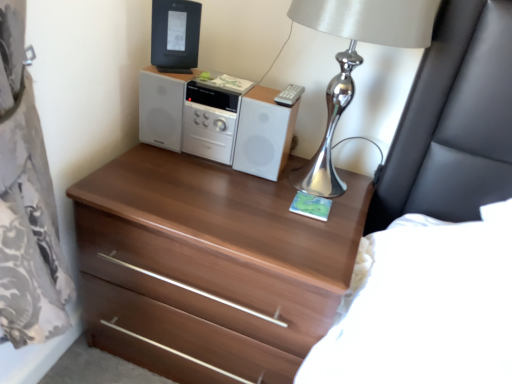
The image size is (512, 384). Identify the location of vacant space that's between silver metallic table lamp at upper right and white glossy stereo at center. (222, 175).